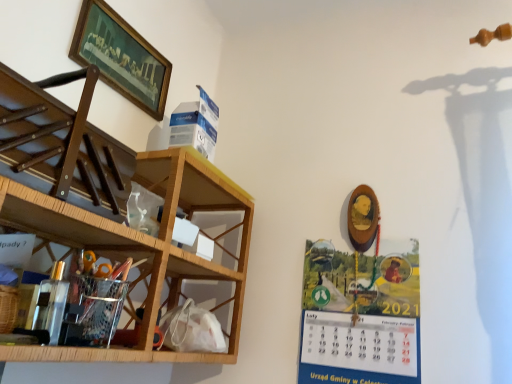
Question: Is metallic silver organizer at lower left, which is counted as the first shelf, starting from the bottom, smaller than metallic calendar at right?

Choices:
 (A) yes
 (B) no

Answer: (B)

Question: From the image's perspective, would you say metallic silver organizer at lower left, which is counted as the first shelf, starting from the bottom, is positioned over metallic calendar at right?

Choices:
 (A) yes
 (B) no

Answer: (A)

Question: From the image's perspective, does metallic silver organizer at lower left, which is counted as the first shelf, starting from the bottom, appear lower than metallic calendar at right?

Choices:
 (A) yes
 (B) no

Answer: (B)

Question: Can you confirm if metallic silver organizer at lower left, which is counted as the first shelf, starting from the bottom, is bigger than metallic calendar at right?

Choices:
 (A) yes
 (B) no

Answer: (A)

Question: Is metallic silver organizer at lower left, the third shelf from the top, closer to the viewer compared to metallic calendar at right?

Choices:
 (A) no
 (B) yes

Answer: (B)

Question: Is point (77, 49) positioned closer to the camera than point (34, 223)?

Choices:
 (A) closer
 (B) farther

Answer: (B)

Question: Considering the positions of wooden framed painting at upper left and metallic silver organizer at lower left, which is counted as the first shelf, starting from the bottom, in the image, is wooden framed painting at upper left wider or thinner than metallic silver organizer at lower left, which is counted as the first shelf, starting from the bottom,?

Choices:
 (A) thin
 (B) wide

Answer: (A)

Question: Is wooden framed painting at upper left to the left or to the right of metallic silver organizer at lower left, which is counted as the first shelf, starting from the bottom, in the image?

Choices:
 (A) right
 (B) left

Answer: (A)

Question: Is wooden framed painting at upper left taller or shorter than metallic silver organizer at lower left, which is counted as the first shelf, starting from the bottom?

Choices:
 (A) tall
 (B) short

Answer: (A)

Question: Is metallic calendar at right bigger or smaller than wooden at left, the 3th shelf positioned from the bottom?

Choices:
 (A) small
 (B) big

Answer: (A)

Question: Is metallic calendar at right in front of or behind wooden at left, placed as the 1th shelf when sorted from top to bottom, in the image?

Choices:
 (A) front
 (B) behind

Answer: (B)

Question: From the image's perspective, is metallic calendar at right located above or below wooden at left, the 3th shelf positioned from the bottom?

Choices:
 (A) above
 (B) below

Answer: (B)

Question: From a real-world perspective, is metallic calendar at right physically located above or below wooden at left, the 3th shelf positioned from the bottom?

Choices:
 (A) above
 (B) below

Answer: (B)

Question: Looking at their shapes, would you say wooden framed painting at upper left is wider or thinner than metallic calendar at right?

Choices:
 (A) thin
 (B) wide

Answer: (B)

Question: From the image's perspective, is wooden framed painting at upper left located above or below metallic calendar at right?

Choices:
 (A) below
 (B) above

Answer: (B)